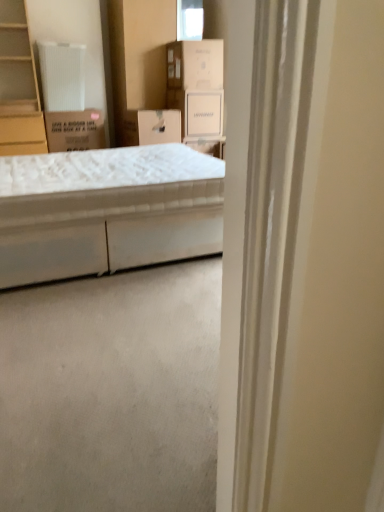
Question: From a real-world perspective, is brown cardboard box at upper left, the second cardboard box positioned from the top, physically located above or below white cardboard box at center, the first storage box from the left?

Choices:
 (A) below
 (B) above

Answer: (A)

Question: Which is correct: brown cardboard box at upper left, marked as the second cardboard box in a right-to-left arrangement, is inside white cardboard box at center, the first storage box from the left, or outside of it?

Choices:
 (A) inside
 (B) outside

Answer: (B)

Question: Which object is positioned farthest from the light brown wood cabinet at left?

Choices:
 (A) brown cardboard box at upper left, marked as the second cardboard box in a right-to-left arrangement
 (B) white cardboard box at upper center, the 1th cardboard box from the right
 (C) white fabric bed at center
 (D) white cardboard box at center, which is the 2th storage box in right-to-left order
 (E) white cardboard box at upper center, which appears as the 2th storage box when viewed from the left

Answer: (C)

Question: Which object is the closest to the white cardboard box at upper center, which appears as the 1th storage box when viewed from the right?

Choices:
 (A) white cardboard box at upper center, the 1th cardboard box from the right
 (B) white cardboard box at center, which is the 2th storage box in right-to-left order
 (C) white fabric bed at center
 (D) light brown wood cabinet at left
 (E) brown cardboard box at upper left, the second cardboard box positioned from the top

Answer: (A)